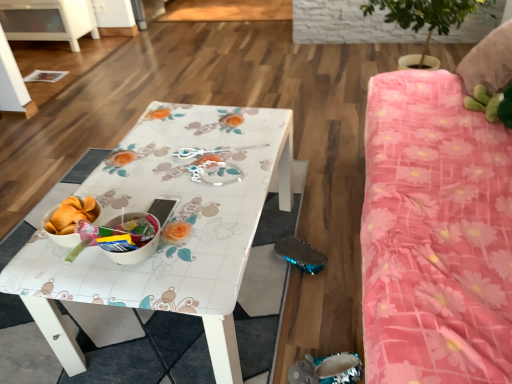
Image resolution: width=512 pixels, height=384 pixels. I want to click on free space in front of clear plastic spoon at center, so click(224, 184).